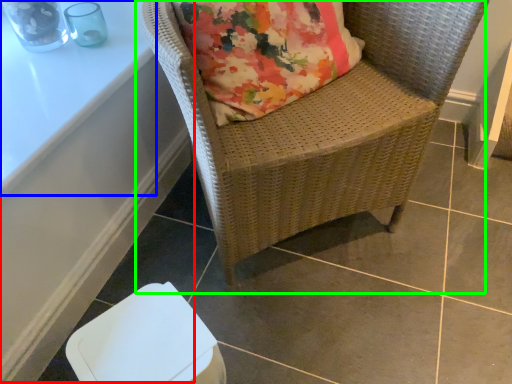
Question: Estimate the real-world distances between objects in this image. Which object is closer to table (highlighted by a red box), table (highlighted by a blue box) or chair (highlighted by a green box)?

Choices:
 (A) table
 (B) chair

Answer: (A)